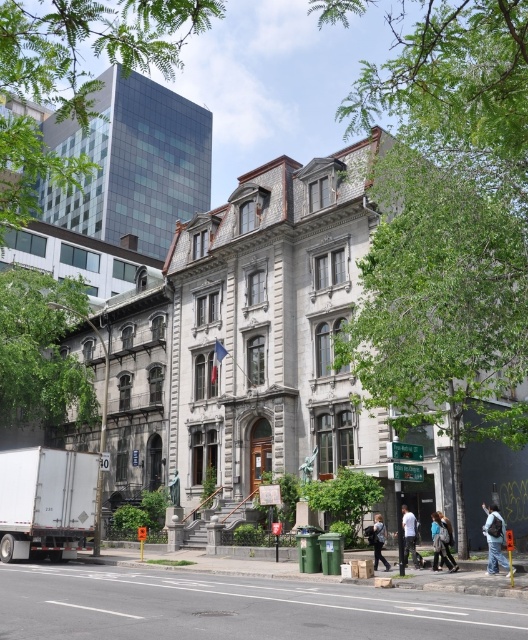
Question: Which point appears farthest from the camera in this image?

Choices:
 (A) (175, 504)
 (B) (441, 554)

Answer: (A)

Question: Is light brown leather jacket at lower center above bronze statue at center?

Choices:
 (A) no
 (B) yes

Answer: (B)

Question: Does denim jacket at lower right have a greater width compared to light blue jeans at center?

Choices:
 (A) no
 (B) yes

Answer: (B)

Question: Does blue denim jeans at lower right have a larger size compared to light brown leather jacket at lower center?

Choices:
 (A) yes
 (B) no

Answer: (A)

Question: Estimate the real-world distances between objects in this image. Which object is farther from the light blue jeans at center?

Choices:
 (A) white matte truck at left
 (B) bronze statue at center

Answer: (B)

Question: Among these objects, which one is farthest from the camera?

Choices:
 (A) denim jacket at lower right
 (B) bronze statue at center

Answer: (B)